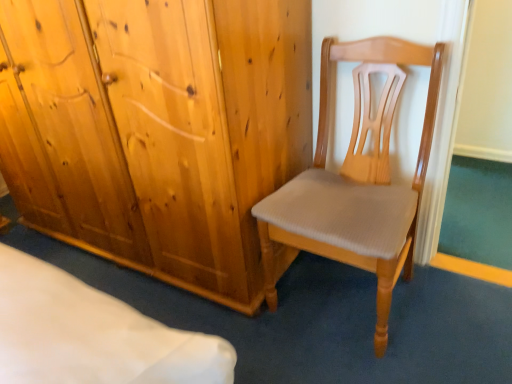
Measure the distance between point (339, 57) and camera.

Point (339, 57) and camera are 4.75 feet apart from each other.

Where is `light brown wood chair at center`? The width and height of the screenshot is (512, 384). light brown wood chair at center is located at coordinates (357, 180).

Describe the element at coordinates (357, 180) in the screenshot. The image size is (512, 384). I see `light brown wood chair at center` at that location.

What do you see at coordinates (158, 129) in the screenshot? I see `natural wood wardrobe at center` at bounding box center [158, 129].

This screenshot has width=512, height=384. Identify the location of natural wood wardrobe at center. (158, 129).

Measure the distance between natural wood wardrobe at center and camera.

The distance of natural wood wardrobe at center from camera is 3.38 feet.

You are a GUI agent. You are given a task and a screenshot of the screen. Output one action in this format:
    pyautogui.click(x=<x>, y=<y>)
    Task: Click on the light brown wood chair at center
    This screenshot has height=384, width=512.
    Given the screenshot: What is the action you would take?
    pyautogui.click(x=357, y=180)

Between natural wood wardrobe at center and light brown wood chair at center, which one appears on the left side from the viewer's perspective?

natural wood wardrobe at center is more to the left.

Is the depth of natural wood wardrobe at center greater than that of light brown wood chair at center?

Yes, it is behind light brown wood chair at center.

Is point (258, 21) farther from viewer compared to point (391, 294)?

No.

From the image's perspective, relative to light brown wood chair at center, is natural wood wardrobe at center above or below?

Based on their image positions, natural wood wardrobe at center is located above light brown wood chair at center.

From a real-world perspective, is natural wood wardrobe at center below light brown wood chair at center?

No, from a real-world perspective, natural wood wardrobe at center is not below light brown wood chair at center.

Which object is thinner, natural wood wardrobe at center or light brown wood chair at center?

Thinner between the two is light brown wood chair at center.

Which of these two, natural wood wardrobe at center or light brown wood chair at center, stands shorter?

With less height is light brown wood chair at center.

Consider the image. Who is smaller, natural wood wardrobe at center or light brown wood chair at center?

light brown wood chair at center is smaller.

Is light brown wood chair at center surrounded by natural wood wardrobe at center?

No.

Would you say natural wood wardrobe at center is a long distance from light brown wood chair at center?

They are positioned close to each other.

Is natural wood wardrobe at center oriented towards light brown wood chair at center?

No, natural wood wardrobe at center is not turned towards light brown wood chair at center.

Locate an element on the screen. The image size is (512, 384). chair lying on the right of natural wood wardrobe at center is located at coordinates (357, 180).

Which object is positioned more to the left, light brown wood chair at center or natural wood wardrobe at center?

Positioned to the left is natural wood wardrobe at center.

Between light brown wood chair at center and natural wood wardrobe at center, which one is positioned in front?

light brown wood chair at center is closer to the camera.

Is point (334, 257) closer or farther from the camera than point (206, 228)?

Point (334, 257) appears to be closer to the viewer than point (206, 228).

From the image's perspective, would you say light brown wood chair at center is shown under natural wood wardrobe at center?

Indeed, from the image's perspective, light brown wood chair at center is shown beneath natural wood wardrobe at center.

From a real-world perspective, is light brown wood chair at center positioned under natural wood wardrobe at center based on gravity?

Yes, from a real-world perspective, light brown wood chair at center is beneath natural wood wardrobe at center.

Does light brown wood chair at center have a lesser width compared to natural wood wardrobe at center?

Yes.

Can you confirm if light brown wood chair at center is shorter than natural wood wardrobe at center?

Yes.

Is light brown wood chair at center bigger than natural wood wardrobe at center?

Actually, light brown wood chair at center might be smaller than natural wood wardrobe at center.

Consider the image. Is natural wood wardrobe at center completely or partially inside light brown wood chair at center?

No.

Is light brown wood chair at center touching natural wood wardrobe at center?

There is a gap between light brown wood chair at center and natural wood wardrobe at center.

Based on the photo, is natural wood wardrobe at center at the back of light brown wood chair at center?

No, light brown wood chair at center is not facing the opposite direction of natural wood wardrobe at center.

Can you tell me how much light brown wood chair at center and natural wood wardrobe at center differ in facing direction?

The angular difference between light brown wood chair at center and natural wood wardrobe at center is 0.859 degrees.

Measure the distance from light brown wood chair at center to natural wood wardrobe at center.

light brown wood chair at center is 15.69 inches from natural wood wardrobe at center.

Locate an element on the screen. This screenshot has width=512, height=384. cupboard above the light brown wood chair at center (from the image's perspective) is located at coordinates (158, 129).

Locate an element on the screen. This screenshot has height=384, width=512. cupboard that appears on the left of light brown wood chair at center is located at coordinates (158, 129).

Image resolution: width=512 pixels, height=384 pixels. What are the coordinates of `chair below the natural wood wardrobe at center (from a real-world perspective)` in the screenshot? It's located at (357, 180).